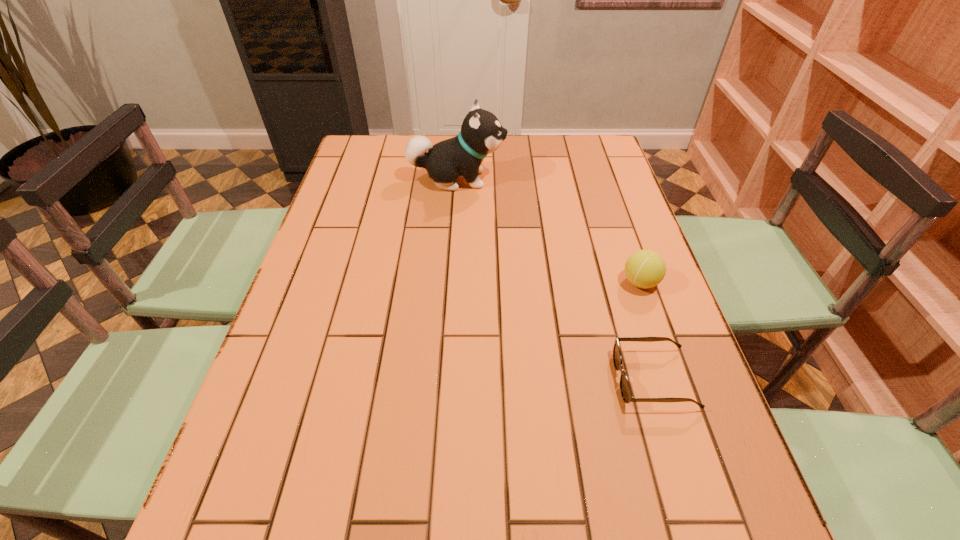
Find the location of `the leftmost object`. the leftmost object is located at coordinates (481, 133).

Locate an element on the screen. the farthest object is located at coordinates (481, 133).

Image resolution: width=960 pixels, height=540 pixels. I want to click on tennis ball, so click(x=645, y=269).

The image size is (960, 540). I want to click on the second tallest object, so click(x=645, y=269).

The width and height of the screenshot is (960, 540). I want to click on the shortest object, so click(x=625, y=388).

At what (x,y) coordinates should I click in order to perform the action: click on sunglasses. Please return your answer as a coordinate pair (x, y). The height and width of the screenshot is (540, 960). Looking at the image, I should click on [625, 388].

Find the location of a particular element. blank space located 0.260m at the face of the leftmost object is located at coordinates (588, 179).

Locate an element on the screen. The image size is (960, 540). free space located on the front of the second nearest object is located at coordinates 700,454.

Where is `free point located at the front lenses of the shortest object`? free point located at the front lenses of the shortest object is located at coordinates (548, 379).

You are a GUI agent. You are given a task and a screenshot of the screen. Output one action in this format:
    pyautogui.click(x=<x>, y=<y>)
    Task: Click on the vacant space situated at the front lenses of the shortest object
    
    Given the screenshot: What is the action you would take?
    pyautogui.click(x=451, y=379)